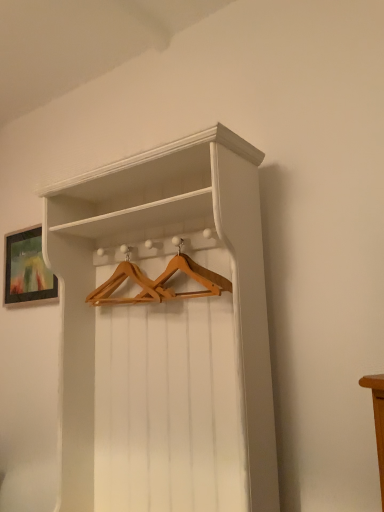
Question: Looking at the image, does matte black picture frame at upper left seem bigger or smaller compared to white wood shelf at center?

Choices:
 (A) big
 (B) small

Answer: (B)

Question: Is matte black picture frame at upper left taller or shorter than white wood shelf at center?

Choices:
 (A) tall
 (B) short

Answer: (B)

Question: Which of these objects is positioned farthest from the matte black picture frame at upper left?

Choices:
 (A) white wood shelf at center
 (B) wooden hanger at center

Answer: (A)

Question: Considering the real-world distances, which object is closest to the wooden hanger at center?

Choices:
 (A) white wood shelf at center
 (B) matte black picture frame at upper left

Answer: (A)